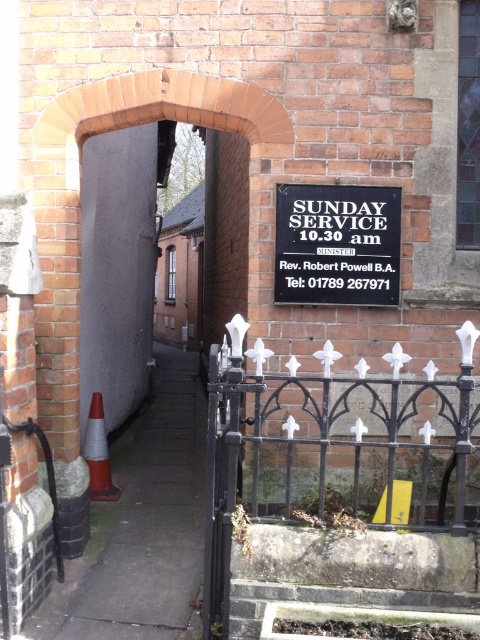
You are a delivery driver who needs to park your van near the orange reflective cone at lower left without hitting the black wrought iron fence at right. Can you safely park there if your van is 2 meters wide?

The black wrought iron fence at right might be wider than the orange reflective cone at lower left, but since the exact width isn generated, it is uncertain if the van can park safely without hitting the fence.

In the scene shown: You are a visitor approaching the church and need to know the size of the black metal sign at center compared to the black wrought iron fence at right. Which one is larger?

The black wrought iron fence at right is bigger than the black metal sign at center.